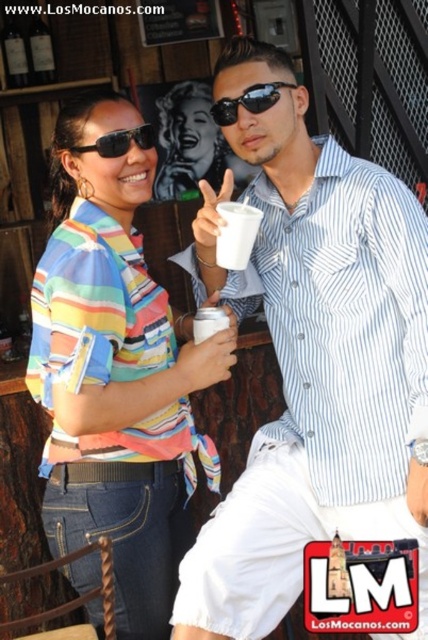
Question: Can you confirm if white matte cup at center is positioned to the right of sunglasses at center?

Choices:
 (A) no
 (B) yes

Answer: (A)

Question: Which of the following is the farthest from the observer?

Choices:
 (A) (76, 280)
 (B) (210, 330)
 (C) (220, 237)
 (D) (142, 148)

Answer: (B)

Question: Considering the relative positions of white striped shirt at center and white matte cup at center in the image provided, where is white striped shirt at center located with respect to white matte cup at center?

Choices:
 (A) above
 (B) below

Answer: (B)

Question: Is white matte cup at center positioned in front of sunglasses at center?

Choices:
 (A) yes
 (B) no

Answer: (A)

Question: Which object is closer to the camera taking this photo?

Choices:
 (A) striped cotton shirt at center
 (B) black matte sunglasses at upper left

Answer: (A)

Question: Which object is farther from the camera taking this photo?

Choices:
 (A) white matte cup at center
 (B) sunglasses at center
 (C) black matte sunglasses at upper left

Answer: (B)